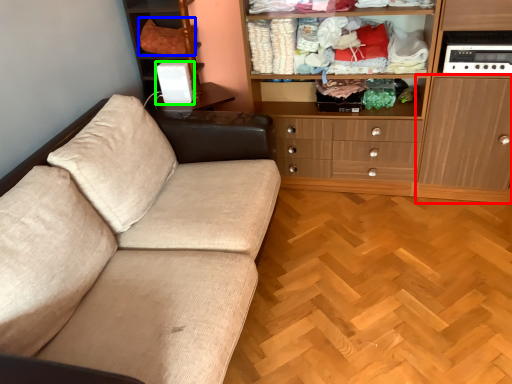
Question: Which is nearer to the cabinetry (highlighted by a red box)? clothing (highlighted by a blue box) or appliance (highlighted by a green box).

Choices:
 (A) clothing
 (B) appliance

Answer: (B)